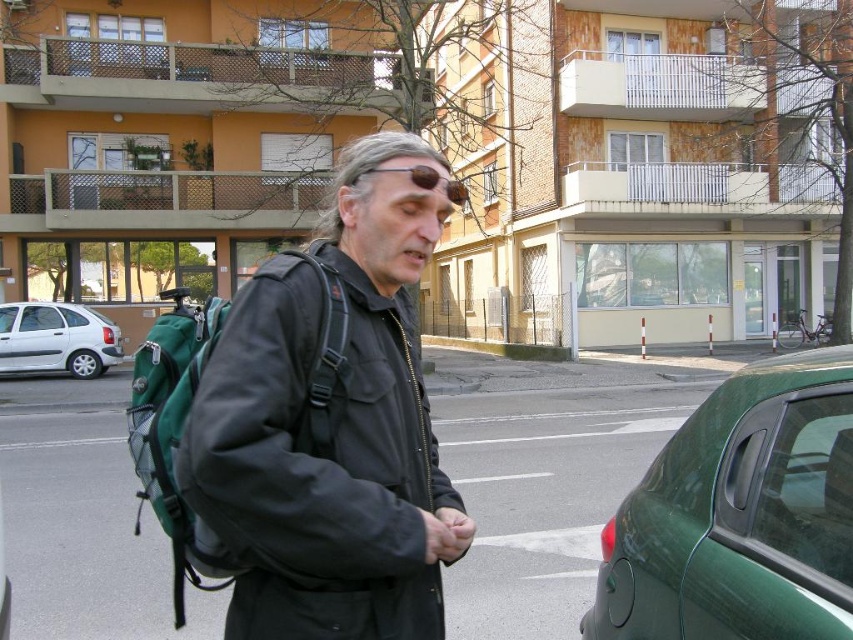
Is green matte car at lower right bigger than green fabric backpack at left?

No.

Who is more distant from viewer, (752, 413) or (198, 552)?

Positioned behind is point (752, 413).

The height and width of the screenshot is (640, 853). Identify the location of green matte car at lower right. (740, 515).

Who is positioned more to the right, green fabric backpack at center or green fabric backpack at left?

green fabric backpack at center is more to the right.

Is green fabric backpack at center positioned in front of green fabric backpack at left?

Yes, green fabric backpack at center is in front of green fabric backpack at left.

Locate an element on the screen. Image resolution: width=853 pixels, height=640 pixels. green fabric backpack at center is located at coordinates (177, 444).

Who is higher up, green fabric backpack at center or white matte car at left?

green fabric backpack at center

Is green fabric backpack at center taller than white matte car at left?

Yes, green fabric backpack at center is taller than white matte car at left.

What do you see at coordinates (177, 444) in the screenshot? I see `green fabric backpack at center` at bounding box center [177, 444].

Locate an element on the screen. The width and height of the screenshot is (853, 640). green fabric backpack at center is located at coordinates (177, 444).